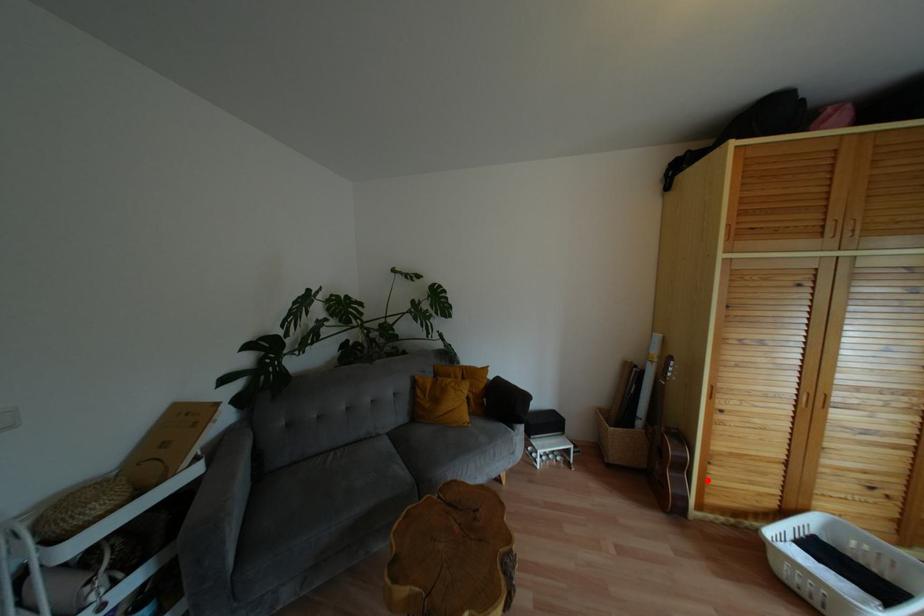
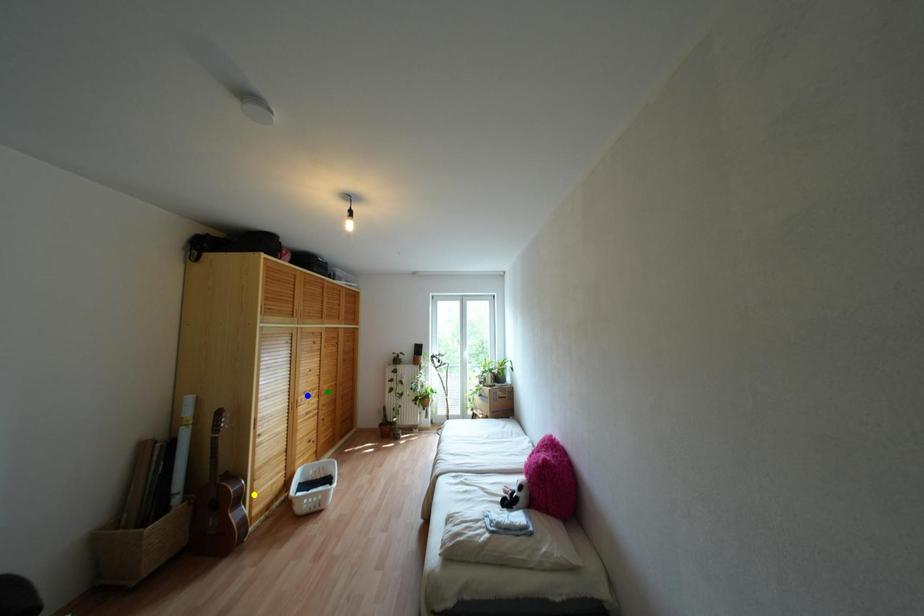
Question: I am providing you with two images of the same scene from different viewpoints. A red point is marked on the first image. You are given multiple points on the second image. Which point in image 2 represents the same 3d spot as the red point in image 1?

Choices:
 (A) blue point
 (B) yellow point
 (C) green point

Answer: (B)